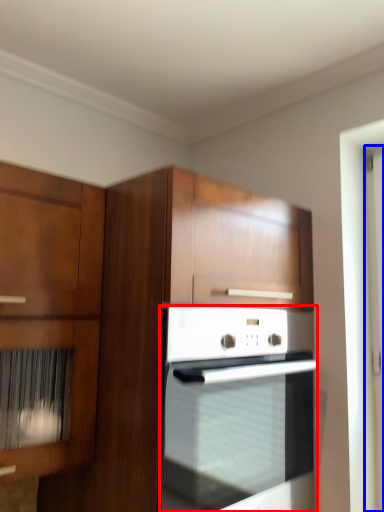
Question: Which of the following is the closest to the observer, oven (highlighted by a red box) or screen door (highlighted by a blue box)?

Choices:
 (A) oven
 (B) screen door

Answer: (A)